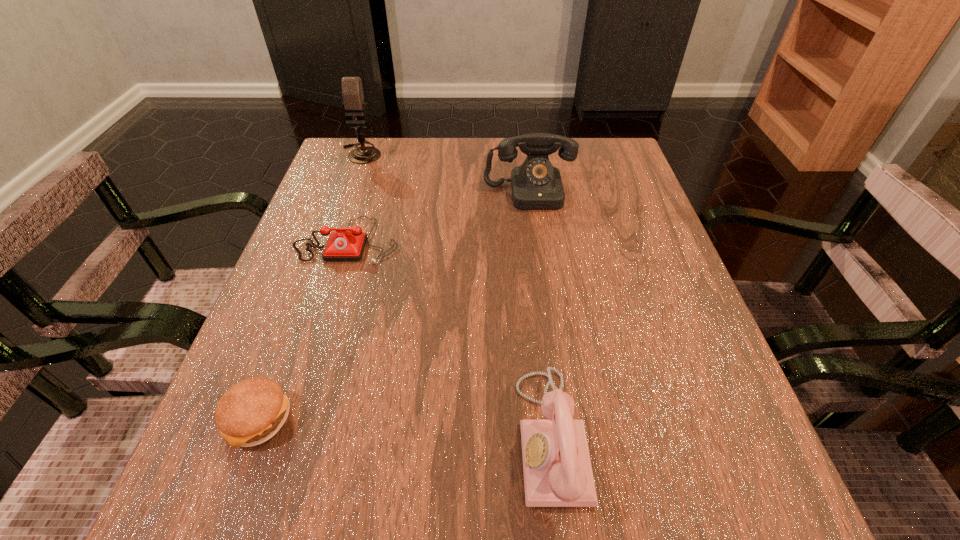
Where is `microphone`? Image resolution: width=960 pixels, height=540 pixels. microphone is located at coordinates (352, 91).

What are the coordinates of `the farthest object` in the screenshot? It's located at (352, 91).

At what (x,y) coordinates should I click in order to perform the action: click on the farthest telephone. Please return your answer as a coordinate pair (x, y). The image size is (960, 540). Looking at the image, I should click on (536, 185).

You are a GUI agent. You are given a task and a screenshot of the screen. Output one action in this format:
    pyautogui.click(x=<x>, y=<y>)
    Task: Click on the second shortest telephone
    The width and height of the screenshot is (960, 540).
    Given the screenshot: What is the action you would take?
    pyautogui.click(x=557, y=467)

Find the location of `the nearest telephone`. the nearest telephone is located at coordinates (557, 467).

Image resolution: width=960 pixels, height=540 pixels. Identify the location of the third nearest object. (342, 245).

The width and height of the screenshot is (960, 540). In order to click on the second farthest telephone in this screenshot , I will do `click(342, 245)`.

Locate an element on the screen. The width and height of the screenshot is (960, 540). hamburger is located at coordinates (251, 412).

You are a GUI agent. You are given a task and a screenshot of the screen. Output one action in this format:
    pyautogui.click(x=<x>, y=<y>)
    Task: Click on the vacant space located 0.150m on the front-facing side of the microphone
    The height and width of the screenshot is (540, 960).
    Given the screenshot: What is the action you would take?
    [x=346, y=199]

Where is `vacant region located 0.160m on the dial of the farthest telephone`? The height and width of the screenshot is (540, 960). vacant region located 0.160m on the dial of the farthest telephone is located at coordinates (539, 259).